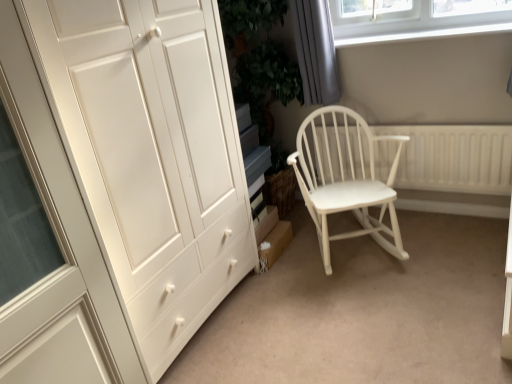
What do you see at coordinates (149, 151) in the screenshot? I see `matte white wardrobe at left` at bounding box center [149, 151].

Describe the element at coordinates (315, 51) in the screenshot. I see `gray fabric curtain at upper right` at that location.

In order to click on matte white wardrobe at left in this screenshot , I will do `click(149, 151)`.

From a real-world perspective, between gray fabric curtain at upper right and white textured radiator at right, who is vertically higher?

From a 3D spatial view, gray fabric curtain at upper right is above.

Is gray fabric curtain at upper right spatially inside white textured radiator at right, or outside of it?

The correct answer is: outside.

Is gray fabric curtain at upper right smaller than white textured radiator at right?

Yes.

Are gray fabric curtain at upper right and white textured radiator at right making contact?

No.

Which is more to the left, white wood rocking chair at center or gray fabric curtain at upper right?

gray fabric curtain at upper right.

The height and width of the screenshot is (384, 512). Find the location of `chair below the gray fabric curtain at upper right (from a real-world perspective)`. chair below the gray fabric curtain at upper right (from a real-world perspective) is located at coordinates (345, 177).

From a real-world perspective, is white wood rocking chair at center below gray fabric curtain at upper right?

Yes, from a real-world perspective, white wood rocking chair at center is below gray fabric curtain at upper right.

From the image's perspective, relative to gray fabric curtain at upper right, is white wood rocking chair at center above or below?

Based on their image positions, white wood rocking chair at center is located beneath gray fabric curtain at upper right.

Is matte white wardrobe at left further to camera compared to white wood rocking chair at center?

No, the depth of matte white wardrobe at left is less than that of white wood rocking chair at center.

In the scene shown: Does matte white wardrobe at left have a lesser width compared to white wood rocking chair at center?

Yes.

From the image's perspective, which object appears higher, matte white wardrobe at left or white wood rocking chair at center?

matte white wardrobe at left is shown above in the image.

Is point (141, 192) positioned after point (195, 339)?

No, (141, 192) is closer to viewer.

In the scene shown: Is white plastic window sill at upper right not inside white wood rocking chair at center?

Absolutely, white plastic window sill at upper right is external to white wood rocking chair at center.

In terms of size, does white plastic window sill at upper right appear bigger or smaller than white wood rocking chair at center?

Clearly, white plastic window sill at upper right is smaller in size than white wood rocking chair at center.

Is the position of white plastic window sill at upper right less distant than that of white wood rocking chair at center?

No, white plastic window sill at upper right is further to the viewer.

In the scene shown: Considering the sizes of objects white plastic window sill at upper right and white wood rocking chair at center in the image provided, who is shorter, white plastic window sill at upper right or white wood rocking chair at center?

With less height is white plastic window sill at upper right.

Measure the distance between matte white wardrobe at left and gray fabric curtain at upper right.

matte white wardrobe at left is 3.36 feet from gray fabric curtain at upper right.

Which is closer to the camera, (192, 8) or (323, 63)?

Clearly, point (192, 8) is closer to the camera than point (323, 63).

From a real-world perspective, who is located lower, matte white wardrobe at left or gray fabric curtain at upper right?

matte white wardrobe at left.

Would you say matte white wardrobe at left contains gray fabric curtain at upper right?

No, gray fabric curtain at upper right is not surrounded by matte white wardrobe at left.

Would you say white textured radiator at right contains white wood rocking chair at center?

No, white wood rocking chair at center is located outside of white textured radiator at right.

From a real-world perspective, does white textured radiator at right stand above white wood rocking chair at center?

No, from a real-world perspective, white textured radiator at right is not above white wood rocking chair at center.

Does white textured radiator at right appear on the left side of white wood rocking chair at center?

In fact, white textured radiator at right is to the right of white wood rocking chair at center.

From the image's perspective, does white textured radiator at right appear lower than white wood rocking chair at center?

No.

In terms of width, does white wood rocking chair at center look wider or thinner when compared to white plastic window sill at upper right?

Considering their sizes, white wood rocking chair at center looks broader than white plastic window sill at upper right.

Is white wood rocking chair at center taller or shorter than white plastic window sill at upper right?

Clearly, white wood rocking chair at center is taller compared to white plastic window sill at upper right.

Where is `plain in front of the white plastic window sill at upper right`? This screenshot has height=384, width=512. plain in front of the white plastic window sill at upper right is located at coordinates (362, 311).

From a real-world perspective, is white wood rocking chair at center beneath white plastic window sill at upper right?

Yes, from a real-world perspective, white wood rocking chair at center is beneath white plastic window sill at upper right.

Find the location of a particular element. The width and height of the screenshot is (512, 384). radiator lying on the right of gray fabric curtain at upper right is located at coordinates (454, 158).

The image size is (512, 384). Identify the location of chair in front of the gray fabric curtain at upper right. (345, 177).

When comparing their distances from white textured radiator at right, does white wood rocking chair at center or matte white wardrobe at left seem further?

The object further to white textured radiator at right is matte white wardrobe at left.

From the image, which object appears to be farther from white wood rocking chair at center, white plastic window sill at upper right or gray fabric curtain at upper right?

white plastic window sill at upper right lies further to white wood rocking chair at center than the other object.

Which object lies further to the anchor point white wood rocking chair at center, white textured radiator at right or white wood rocking chair at center?

The object further to white wood rocking chair at center is white textured radiator at right.

Estimate the real-world distances between objects in this image. Which object is closer to white wood rocking chair at center, matte white wardrobe at left or gray fabric curtain at upper right?

gray fabric curtain at upper right is closer to white wood rocking chair at center.

Looking at the image, which one is located further to white plastic window sill at upper right, gray fabric curtain at upper right or matte white wardrobe at left?

matte white wardrobe at left is positioned further to the anchor white plastic window sill at upper right.

When comparing their distances from white wood rocking chair at center, does white plastic window sill at upper right or white textured radiator at right seem closer?

A: white textured radiator at right lies closer to white wood rocking chair at center than the other object.

Consider the image. Considering their positions, is matte white wardrobe at left positioned further to white plastic window sill at upper right than white textured radiator at right?

The object further to white plastic window sill at upper right is matte white wardrobe at left.

Considering their positions, is matte white wardrobe at left positioned further to white plastic window sill at upper right than gray fabric curtain at upper right?

matte white wardrobe at left is positioned further to the anchor white plastic window sill at upper right.

Find the location of `curtain between white plastic window sill at upper right and white textured radiator at right in the up-down direction`. curtain between white plastic window sill at upper right and white textured radiator at right in the up-down direction is located at coordinates (315, 51).

Image resolution: width=512 pixels, height=384 pixels. Find the location of `chair between matte white wardrobe at left and white wood rocking chair at center from left to right`. chair between matte white wardrobe at left and white wood rocking chair at center from left to right is located at coordinates (345, 177).

Where is `radiator that lies between white plastic window sill at upper right and white wood rocking chair at center from top to bottom`? radiator that lies between white plastic window sill at upper right and white wood rocking chair at center from top to bottom is located at coordinates (454, 158).

Identify the location of chair between gray fabric curtain at upper right and white wood rocking chair at center from top to bottom. (345, 177).